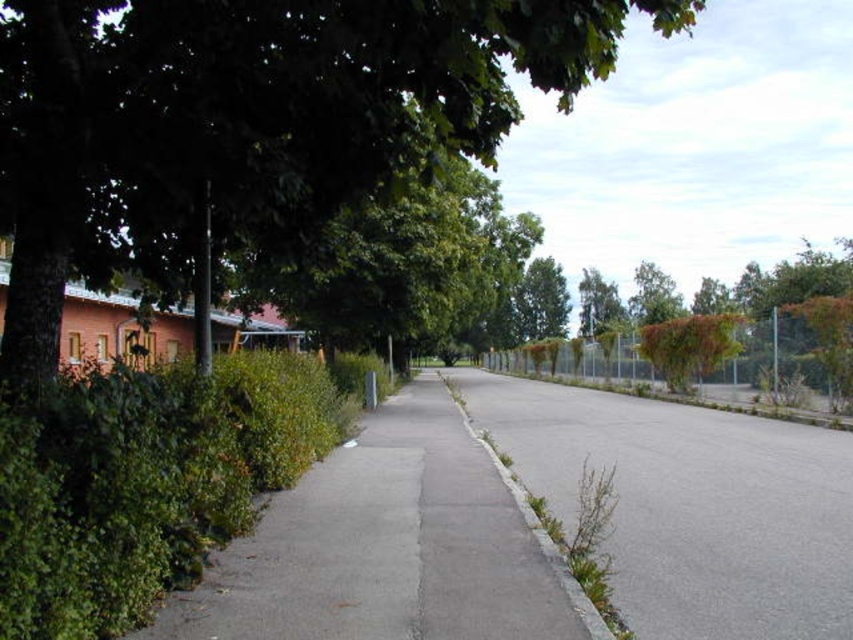
Question: Which object appears closest to the camera in this image?

Choices:
 (A) gray concrete curb at center
 (B) gray asphalt pavement at center

Answer: (A)

Question: Does green leafy tree at upper left come in front of gray asphalt pavement at center?

Choices:
 (A) no
 (B) yes

Answer: (B)

Question: Estimate the real-world distances between objects in this image. Which object is farther from the green leafy tree at center?

Choices:
 (A) gray concrete curb at center
 (B) green leafy tree at upper center

Answer: (A)

Question: Is green leafy tree at upper left wider than gray concrete curb at center?

Choices:
 (A) yes
 (B) no

Answer: (A)

Question: Which point is farther to the camera?

Choices:
 (A) (556, 552)
 (B) (757, 572)
 (C) (614, 301)
 (D) (531, 307)

Answer: (C)

Question: Is green leafy tree at upper left to the left of green leafy tree at upper center from the viewer's perspective?

Choices:
 (A) no
 (B) yes

Answer: (B)